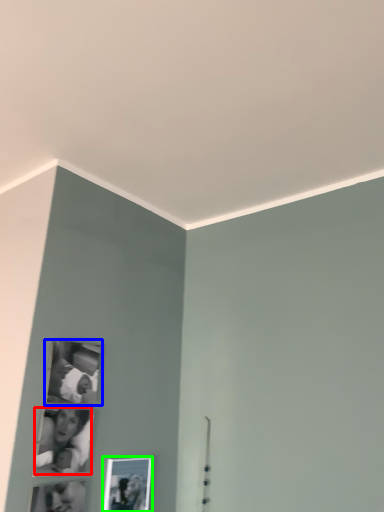
Question: Based on their relative distances, which object is nearer to couple (highlighted by a red box)? Choose from picture frame (highlighted by a blue box) and picture frame (highlighted by a green box).

Choices:
 (A) picture frame
 (B) picture frame

Answer: (A)